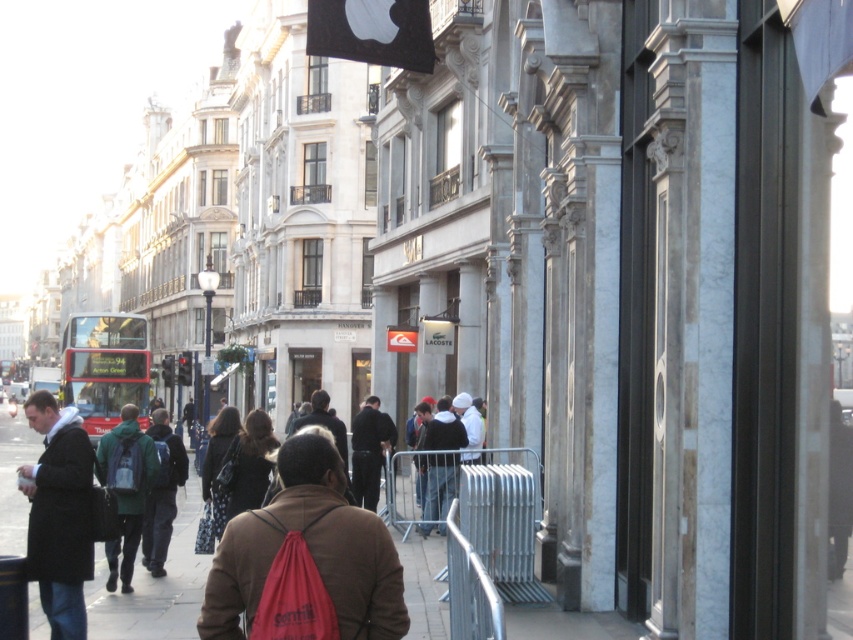
Question: Estimate the real-world distances between objects in this image. Which object is farther from the brown fabric bag at center?

Choices:
 (A) green backpack at center
 (B) green fabric backpack at center

Answer: (A)

Question: Is red metallic bus at left to the right of green backpack at center from the viewer's perspective?

Choices:
 (A) yes
 (B) no

Answer: (B)

Question: Does brown fabric bag at center have a smaller size compared to green backpack at center?

Choices:
 (A) yes
 (B) no

Answer: (B)

Question: Can you confirm if red metallic bus at left is positioned to the right of green fabric backpack at center?

Choices:
 (A) yes
 (B) no

Answer: (B)

Question: Estimate the real-world distances between objects in this image. Which object is closer to the galvanized metal barrier at center?

Choices:
 (A) dark brown leather coat at lower left
 (B) brown fabric bag at center
 (C) brown fabric backpack at center
 (D) red metallic bus at left

Answer: (B)

Question: Considering the real-world distances, which object is closest to the green fabric backpack at center?

Choices:
 (A) red metallic bus at left
 (B) brown fabric backpack at center
 (C) green backpack at center
 (D) dark brown leather coat at lower left

Answer: (C)